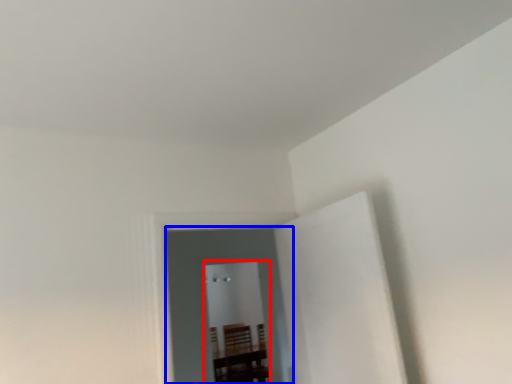
Question: Among these objects, which one is nearest to the camera, glass door (highlighted by a red box) or glass door (highlighted by a blue box)?

Choices:
 (A) glass door
 (B) glass door

Answer: (B)